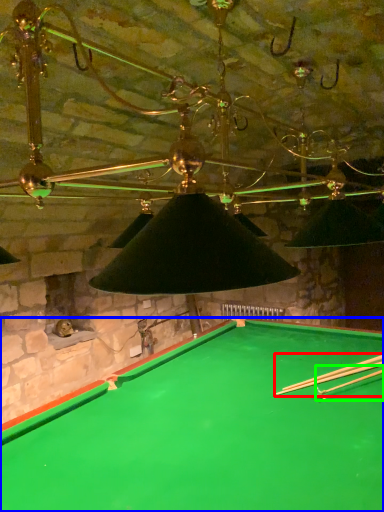
Question: Based on their relative distances, which object is nearer to cue (highlighted by a red box)? Choose from billiard table (highlighted by a blue box) and cue (highlighted by a green box).

Choices:
 (A) billiard table
 (B) cue

Answer: (B)